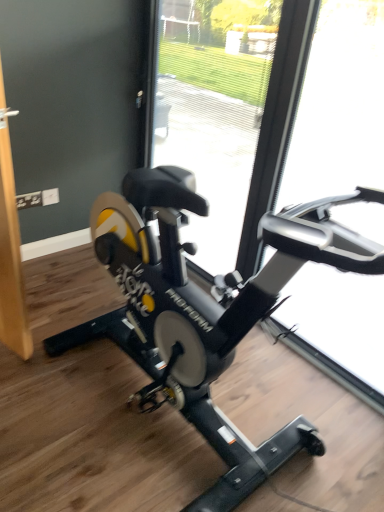
Question: Would you say transparent glass door at center, which ranks as the 1th glass door in left-to-right order, is to the left or to the right of transparent glass door at right, which is the second glass door from left to right, in the picture?

Choices:
 (A) right
 (B) left

Answer: (B)

Question: Considering their positions, is transparent glass door at center, which is the 2th glass door in right-to-left order, located in front of or behind transparent glass door at right, which appears as the first glass door when viewed from the right?

Choices:
 (A) behind
 (B) front

Answer: (A)

Question: Which object is the farthest from the transparent glass door at center, which is the 2th glass door in right-to-left order?

Choices:
 (A) black matte stationary bicycle at center
 (B) transparent glass door at right, which is the second glass door from left to right

Answer: (A)

Question: Which is farther from the transparent glass door at right, which appears as the first glass door when viewed from the right?

Choices:
 (A) transparent glass door at center, which ranks as the 1th glass door in left-to-right order
 (B) black matte stationary bicycle at center

Answer: (B)